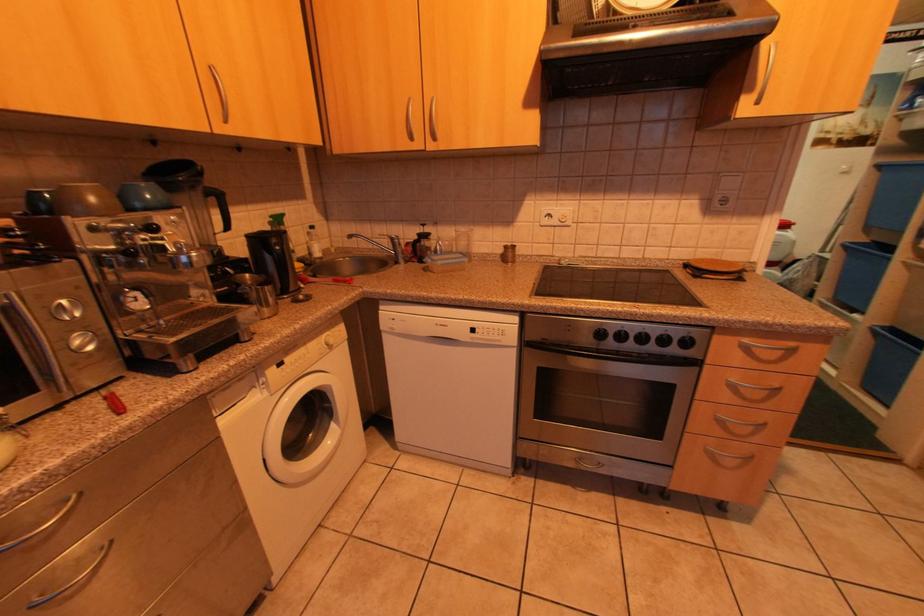
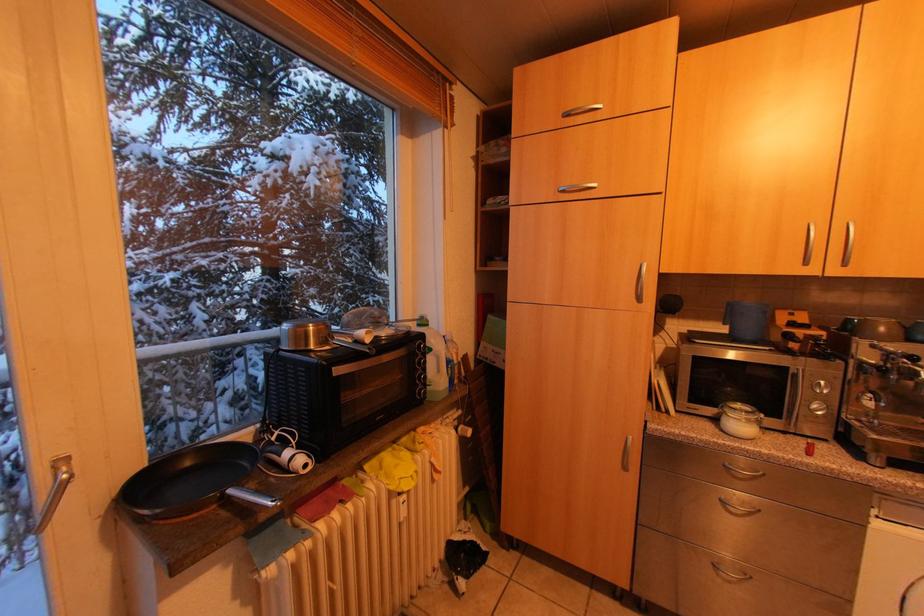
Question: How did the camera likely rotate?

Choices:
 (A) Left
 (B) Right
 (C) Up
 (D) Down

Answer: (A)